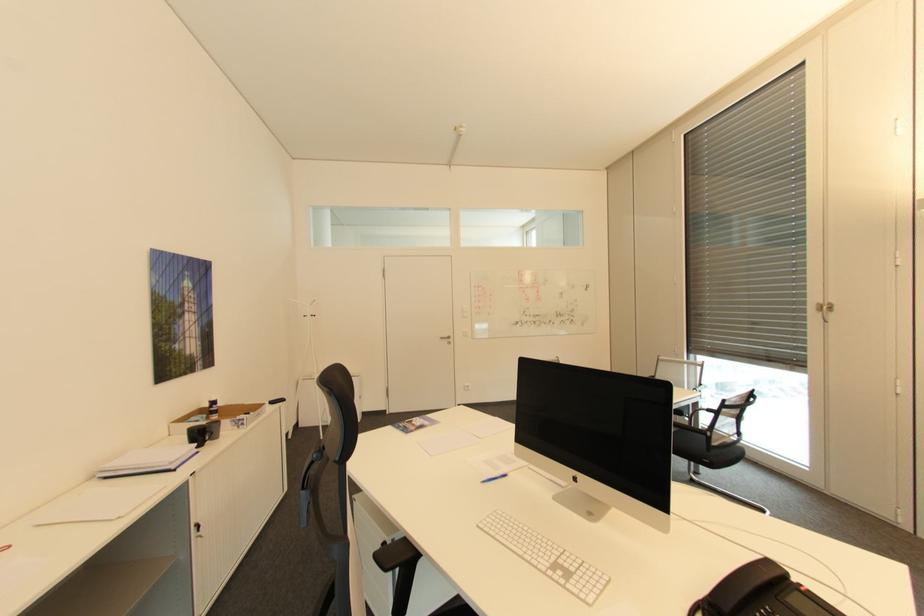
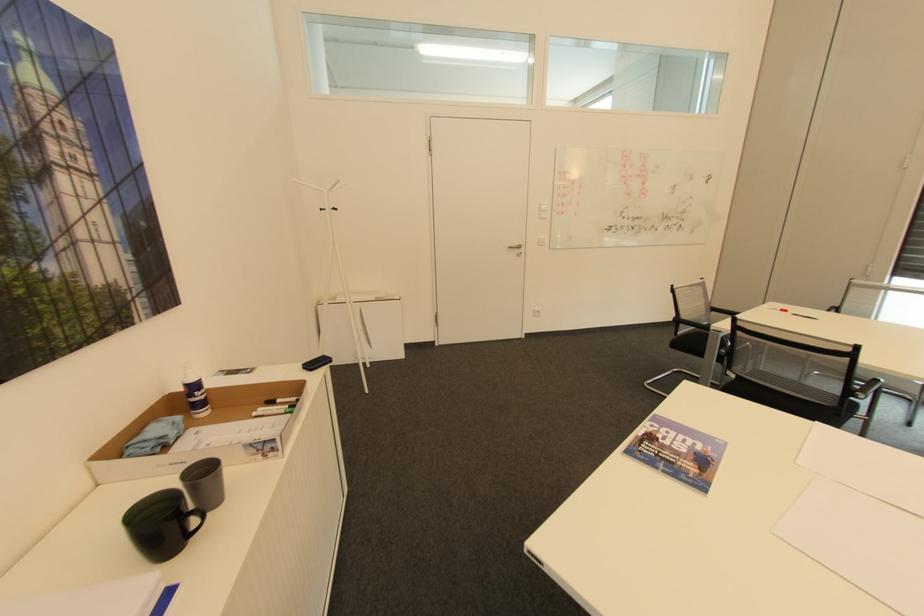
The point at (x=454, y=337) is marked in the first image. Where is the corresponding point in the second image?

(524, 246)